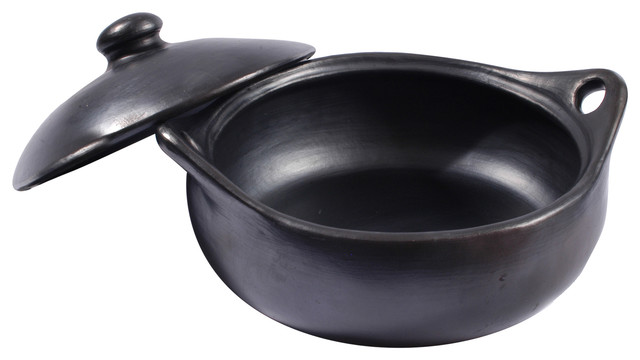
The width and height of the screenshot is (640, 360). Find the location of `rim in pot to hold lid`. rim in pot to hold lid is located at coordinates (259, 91), (508, 91), (580, 164).